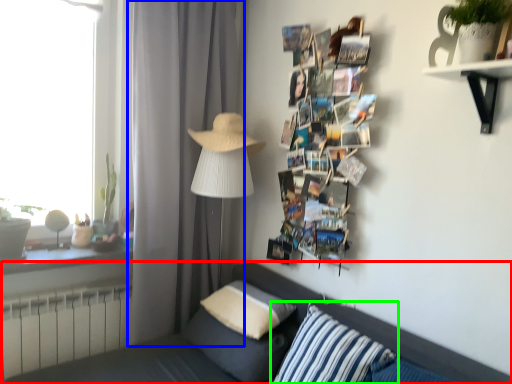
Question: Which object is the closest to the studio couch (highlighted by a red box)? Choose among these: curtain (highlighted by a blue box) or pillow (highlighted by a green box).

Choices:
 (A) curtain
 (B) pillow

Answer: (B)